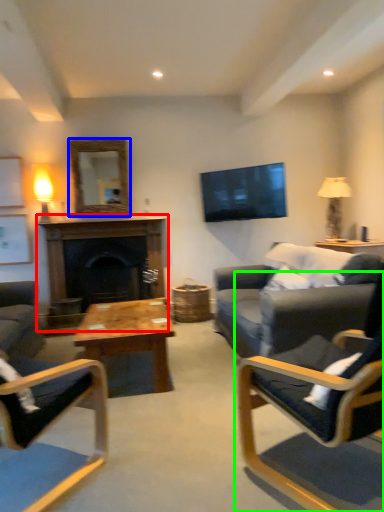
Question: Which is farther away from fireplace (highlighted by a red box)? mirror (highlighted by a blue box) or chair (highlighted by a green box)?

Choices:
 (A) mirror
 (B) chair

Answer: (B)